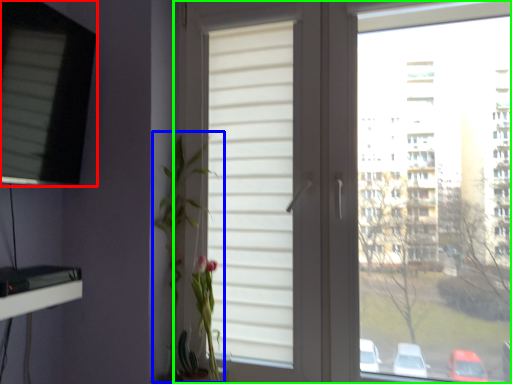
Question: Considering the real-world distances, which object is farthest from window (highlighted by a red box)? floral arrangement (highlighted by a blue box) or window (highlighted by a green box)?

Choices:
 (A) floral arrangement
 (B) window

Answer: (B)